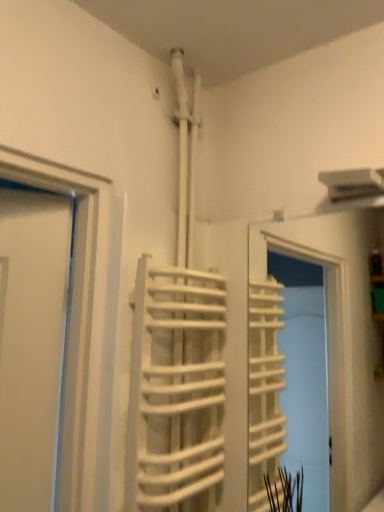
Question: Does green matte plant at lower right appear on the left side of white matte stair at center?

Choices:
 (A) yes
 (B) no

Answer: (B)

Question: From a real-world perspective, is green matte plant at lower right over white matte stair at center?

Choices:
 (A) yes
 (B) no

Answer: (B)

Question: Considering the relative sizes of green matte plant at lower right and white matte stair at center in the image provided, is green matte plant at lower right thinner than white matte stair at center?

Choices:
 (A) no
 (B) yes

Answer: (B)

Question: From a real-world perspective, is green matte plant at lower right under white matte stair at center?

Choices:
 (A) yes
 (B) no

Answer: (A)

Question: Is green matte plant at lower right smaller than white matte stair at center?

Choices:
 (A) yes
 (B) no

Answer: (A)

Question: Can you confirm if green matte plant at lower right is wider than white matte stair at center?

Choices:
 (A) yes
 (B) no

Answer: (B)

Question: Can you confirm if white matte stair at center is bigger than green matte plant at lower right?

Choices:
 (A) yes
 (B) no

Answer: (A)

Question: Does white matte stair at center have a smaller size compared to green matte plant at lower right?

Choices:
 (A) yes
 (B) no

Answer: (B)

Question: Are white matte stair at center and green matte plant at lower right located far from each other?

Choices:
 (A) yes
 (B) no

Answer: (B)

Question: From a real-world perspective, is white matte stair at center beneath green matte plant at lower right?

Choices:
 (A) yes
 (B) no

Answer: (B)

Question: Considering the relative positions of white matte stair at center and green matte plant at lower right in the image provided, is white matte stair at center to the left of green matte plant at lower right from the viewer's perspective?

Choices:
 (A) no
 (B) yes

Answer: (B)

Question: Is white matte stair at center oriented away from green matte plant at lower right?

Choices:
 (A) yes
 (B) no

Answer: (B)

Question: Does point (152, 291) appear closer or farther from the camera than point (279, 471)?

Choices:
 (A) farther
 (B) closer

Answer: (B)